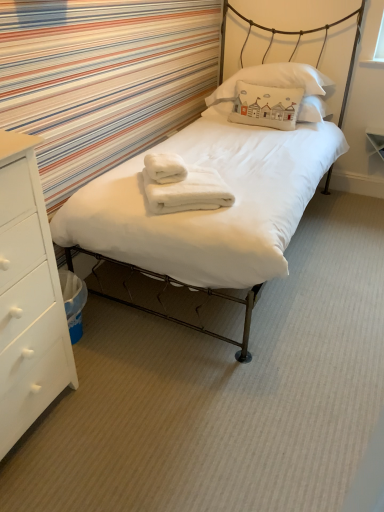
The image size is (384, 512). What are the coordinates of `free area in between white matte chest of drawers at left and white soft bed at center` in the screenshot? It's located at (140, 386).